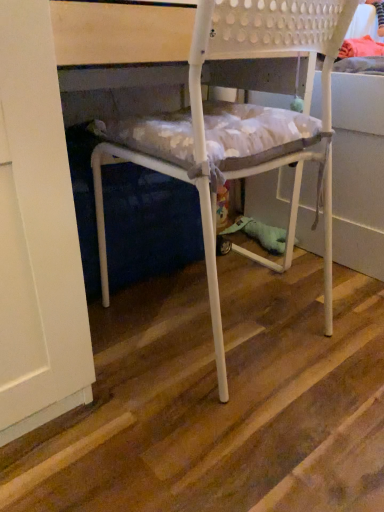
Question: Considering their positions, is wooden at center located in front of or behind white matte plastic chair at center?

Choices:
 (A) front
 (B) behind

Answer: (A)

Question: Considering the positions of wooden at center and white matte plastic chair at center in the image, is wooden at center wider or thinner than white matte plastic chair at center?

Choices:
 (A) wide
 (B) thin

Answer: (A)

Question: From their relative heights in the image, would you say wooden at center is taller or shorter than white matte plastic chair at center?

Choices:
 (A) tall
 (B) short

Answer: (B)

Question: Is point (96, 182) positioned closer to the camera than point (286, 444)?

Choices:
 (A) closer
 (B) farther

Answer: (B)

Question: In the image, is white matte plastic chair at center positioned in front of or behind wooden at center?

Choices:
 (A) behind
 (B) front

Answer: (A)

Question: In terms of height, does white matte plastic chair at center look taller or shorter compared to wooden at center?

Choices:
 (A) tall
 (B) short

Answer: (A)

Question: From the image's perspective, is white matte plastic chair at center located above or below wooden at center?

Choices:
 (A) above
 (B) below

Answer: (A)